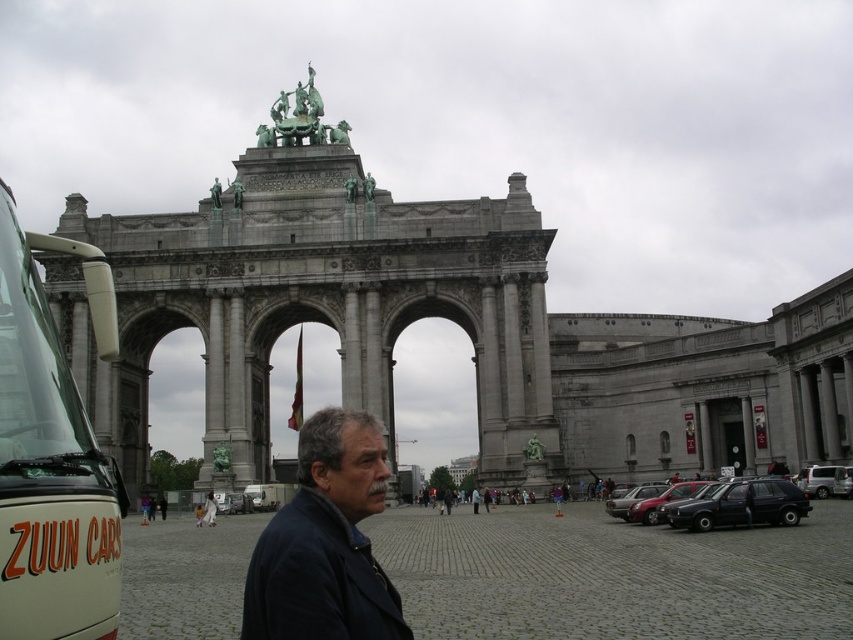
In the scene shown: You are a tourist standing in front of the grand monument. You see the white matte bus at left and the dark blue jacket at center. Which object is positioned higher in the image?

The white matte bus at left is positioned higher than the dark blue jacket at center in the image.

You are a tour guide standing in front of the grand monument. A tourist asks if the white matte bus at left is within a safe distance for a group photo. Given that the recommended safe distance for group photos is 150 feet, can the bus be included in the photo without being too far?

The white matte bus at left is 186.34 feet away from the camera, which exceeds the recommended safe distance of 150 feet. Therefore, the bus may appear too small or distant in the group photo.